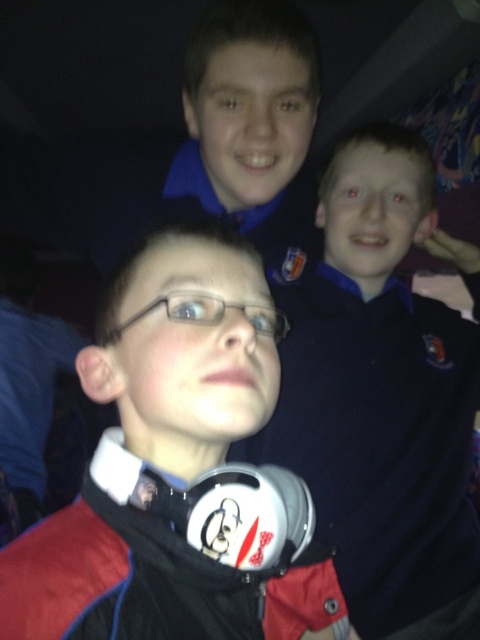
Question: Which point appears closest to the camera in this image?

Choices:
 (A) (472, 368)
 (B) (177, 314)
 (C) (239, 333)

Answer: (C)

Question: Does matte black shirt at upper right come in front of transparent plastic glasses at center?

Choices:
 (A) yes
 (B) no

Answer: (B)

Question: Which object is positioned closest to the matte black headphones at center?

Choices:
 (A) matte black shirt at upper right
 (B) transparent plastic glasses at center

Answer: (B)

Question: Which point appears closest to the camera in this image?

Choices:
 (A) [x=254, y=314]
 (B) [x=252, y=564]
 (C) [x=469, y=392]

Answer: (B)

Question: Does matte black headphones at center appear on the left side of matte black shirt at upper right?

Choices:
 (A) no
 (B) yes

Answer: (B)

Question: Is matte black headphones at center positioned at the back of transparent plastic glasses at center?

Choices:
 (A) yes
 (B) no

Answer: (B)